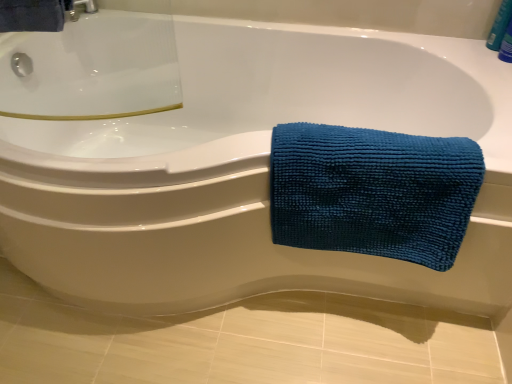
Find the location of a particular element. This screenshot has width=512, height=384. blue plastic bottle at upper right is located at coordinates (500, 26).

This screenshot has width=512, height=384. What do you see at coordinates (500, 26) in the screenshot? I see `blue plastic bottle at upper right` at bounding box center [500, 26].

What do you see at coordinates (373, 192) in the screenshot? I see `teal microfiber towel at right` at bounding box center [373, 192].

The width and height of the screenshot is (512, 384). I want to click on teal microfiber towel at right, so click(x=373, y=192).

Where is `blue plastic bottle at upper right`? This screenshot has width=512, height=384. blue plastic bottle at upper right is located at coordinates (500, 26).

Which is more to the right, blue plastic bottle at upper right or teal microfiber towel at right?

From the viewer's perspective, blue plastic bottle at upper right appears more on the right side.

Based on the photo, is blue plastic bottle at upper right positioned behind teal microfiber towel at right?

That is True.

Which is closer to the camera, (x=489, y=38) or (x=450, y=238)?

Point (x=489, y=38) appears to be farther away from the viewer than point (x=450, y=238).

From the image's perspective, which one is positioned lower, blue plastic bottle at upper right or teal microfiber towel at right?

From the image's view, teal microfiber towel at right is below.

Based on the photo, from a real-world perspective, does blue plastic bottle at upper right sit lower than teal microfiber towel at right?

No, from a real-world perspective, blue plastic bottle at upper right is not under teal microfiber towel at right.

Considering the relative sizes of blue plastic bottle at upper right and teal microfiber towel at right in the image provided, is blue plastic bottle at upper right wider than teal microfiber towel at right?

No.

Is blue plastic bottle at upper right shorter than teal microfiber towel at right?

Yes, blue plastic bottle at upper right is shorter than teal microfiber towel at right.

Who is smaller, blue plastic bottle at upper right or teal microfiber towel at right?

blue plastic bottle at upper right.

Would you say blue plastic bottle at upper right is outside teal microfiber towel at right?

Yes, blue plastic bottle at upper right is outside of teal microfiber towel at right.

Can you see blue plastic bottle at upper right touching teal microfiber towel at right?

No, blue plastic bottle at upper right is not next to teal microfiber towel at right.

Is teal microfiber towel at right at the back of blue plastic bottle at upper right?

No.

How different are the orientations of blue plastic bottle at upper right and teal microfiber towel at right in degrees?

The facing directions of blue plastic bottle at upper right and teal microfiber towel at right are 22.4 degrees apart.

In order to click on toiletry above the teal microfiber towel at right (from a real-world perspective) in this screenshot , I will do `click(500, 26)`.

Considering the positions of objects teal microfiber towel at right and blue plastic bottle at upper right in the image provided, who is more to the left, teal microfiber towel at right or blue plastic bottle at upper right?

Positioned to the left is teal microfiber towel at right.

Who is more distant, teal microfiber towel at right or blue plastic bottle at upper right?

blue plastic bottle at upper right is more distant.

Is point (397, 207) behind point (506, 4)?

No, it is in front of (506, 4).

From the image's perspective, which is above, teal microfiber towel at right or blue plastic bottle at upper right?

From the image's view, blue plastic bottle at upper right is above.

From a real-world perspective, is teal microfiber towel at right positioned over blue plastic bottle at upper right based on gravity?

No, from a real-world perspective, teal microfiber towel at right is not over blue plastic bottle at upper right

Does teal microfiber towel at right have a lesser width compared to blue plastic bottle at upper right?

No, teal microfiber towel at right is not thinner than blue plastic bottle at upper right.

Between teal microfiber towel at right and blue plastic bottle at upper right, which one has more height?

Standing taller between the two is teal microfiber towel at right.

In the scene shown: Considering the relative sizes of teal microfiber towel at right and blue plastic bottle at upper right in the image provided, is teal microfiber towel at right smaller than blue plastic bottle at upper right?

No, teal microfiber towel at right is not smaller than blue plastic bottle at upper right.

Is teal microfiber towel at right surrounding blue plastic bottle at upper right?

No.

Is teal microfiber towel at right next to blue plastic bottle at upper right and touching it?

No, teal microfiber towel at right is not making contact with blue plastic bottle at upper right.

Is teal microfiber towel at right turned away from blue plastic bottle at upper right?

Yes, teal microfiber towel at right is facing away from blue plastic bottle at upper right.

Based on the photo, how different are the orientations of teal microfiber towel at right and blue plastic bottle at upper right in degrees?

teal microfiber towel at right and blue plastic bottle at upper right are facing 22.4 degrees away from each other.

In order to click on toiletry behind the teal microfiber towel at right in this screenshot , I will do `click(500, 26)`.

Where is `towel on the left of blue plastic bottle at upper right`? towel on the left of blue plastic bottle at upper right is located at coordinates (373, 192).

Identify the location of toiletry above the teal microfiber towel at right (from a real-world perspective). Image resolution: width=512 pixels, height=384 pixels. (500, 26).